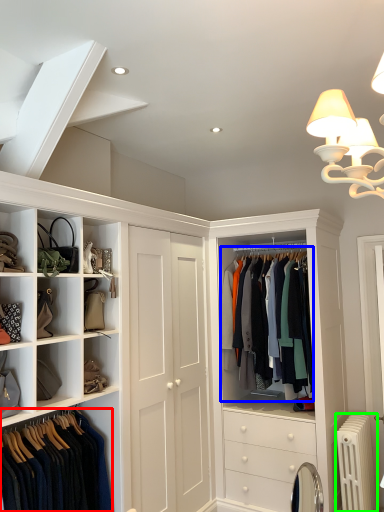
Question: Estimate the real-world distances between objects in this image. Which object is closer to clothing (highlighted by a red box), clothing (highlighted by a blue box) or radiator (highlighted by a green box)?

Choices:
 (A) clothing
 (B) radiator

Answer: (A)